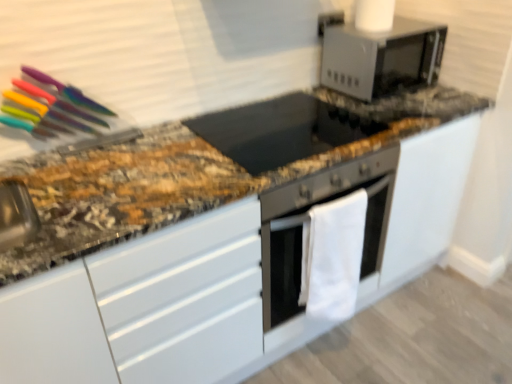
Question: Considering the positions of satin silver microwave at upper right and white fabric oven at center in the image, is satin silver microwave at upper right wider or thinner than white fabric oven at center?

Choices:
 (A) thin
 (B) wide

Answer: (B)

Question: Is satin silver microwave at upper right spatially inside white fabric oven at center, or outside of it?

Choices:
 (A) outside
 (B) inside

Answer: (A)

Question: Which of these objects is positioned closest to the black glass cooktop at center?

Choices:
 (A) satin silver microwave at upper right
 (B) white fabric oven at center

Answer: (A)

Question: Which object is the farthest from the satin silver microwave at upper right?

Choices:
 (A) white fabric oven at center
 (B) black glass cooktop at center

Answer: (A)